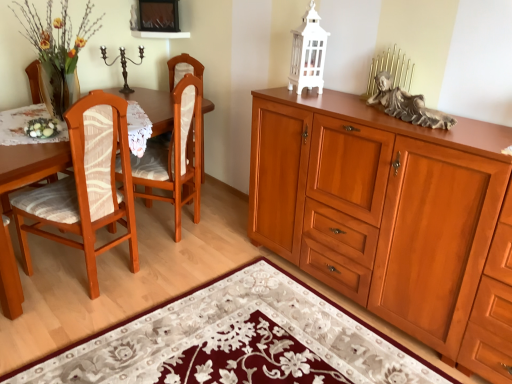
Describe the element at coordinates (407, 105) in the screenshot. I see `gray stone statue at upper right` at that location.

Measure the distance between point (41, 381) and camera.

Point (41, 381) is 5.51 feet away from camera.

Describe the element at coordinates (175, 155) in the screenshot. I see `wooden chair at left, which is the 2th chair from front to back` at that location.

This screenshot has width=512, height=384. I want to click on white lace tablecloth at left, so click(26, 124).

At what (x,y) coordinates should I click in order to perform the action: click on gray stone statue at upper right. Please return your answer as a coordinate pair (x, y). This screenshot has height=384, width=512. Looking at the image, I should click on (407, 105).

Measure the distance between wooden chair at left, arranged as the 1th chair when viewed from the back, and wooden chair at left, placed as the first chair when sorted from front to back.

wooden chair at left, arranged as the 1th chair when viewed from the back, is 40.01 centimeters away from wooden chair at left, placed as the first chair when sorted from front to back.

Locate an element on the screen. chair lying on the right of wooden chair at left, which ranks as the second chair in back-to-front order is located at coordinates (175, 155).

You are a GUI agent. You are given a task and a screenshot of the screen. Output one action in this format:
    pyautogui.click(x=<x>, y=<y>)
    Task: Click on the 1st chair below when counting from the gray stone statue at upper right (from the image's perspective)
    Image resolution: width=512 pixels, height=384 pixels.
    Given the screenshot: What is the action you would take?
    pyautogui.click(x=175, y=155)

Is wooden chair at left, arranged as the 1th chair when viewed from the back, in contact with gray stone statue at upper right?

No, wooden chair at left, arranged as the 1th chair when viewed from the back, is not making contact with gray stone statue at upper right.

Can we say wooden chair at left, which is the 2th chair from front to back, lies outside gray stone statue at upper right?

wooden chair at left, which is the 2th chair from front to back, lies outside gray stone statue at upper right's area.

Is the position of wooden chair at left, which is the 2th chair from front to back, less distant than that of gray stone statue at upper right?

No, wooden chair at left, which is the 2th chair from front to back, is behind gray stone statue at upper right.

How different are the orientations of white lace tablecloth at left and wooden chair at left, arranged as the 1th chair when viewed from the back, in degrees?

129 degrees separate the facing orientations of white lace tablecloth at left and wooden chair at left, arranged as the 1th chair when viewed from the back.

Considering the sizes of objects white lace tablecloth at left and wooden chair at left, which is the 2th chair from front to back, in the image provided, who is taller, white lace tablecloth at left or wooden chair at left, which is the 2th chair from front to back,?

With more height is wooden chair at left, which is the 2th chair from front to back.

Between point (134, 123) and point (177, 162), which one is positioned behind?

The point (177, 162) is farther.

Looking at their sizes, would you say white lace tablecloth at left is wider or thinner than wooden chair at left, arranged as the 1th chair when viewed from the back?

Clearly, white lace tablecloth at left has more width compared to wooden chair at left, arranged as the 1th chair when viewed from the back.

Looking at this image, between wooden cabinet at right and floral rug at lower center, which one has larger size?

With larger size is wooden cabinet at right.

Which object is thinner, wooden cabinet at right or floral rug at lower center?

With smaller width is wooden cabinet at right.

Which of these two, wooden cabinet at right or floral rug at lower center, stands taller?

Standing taller between the two is wooden cabinet at right.

Is wooden cabinet at right turned away from floral rug at lower center?

wooden cabinet at right is not turned away from floral rug at lower center.

In the scene shown: From a real-world perspective, which is physically above, floral rug at lower center or wooden chair at left, which ranks as the second chair in back-to-front order?

wooden chair at left, which ranks as the second chair in back-to-front order, from a real-world perspective.

Starting from the floral rug at lower center, which chair is the 2nd one to the left? Please provide its 2D coordinates.

[(86, 186)]

Is floral rug at lower center positioned with its back to wooden chair at left, placed as the first chair when sorted from front to back?

floral rug at lower center is not turned away from wooden chair at left, placed as the first chair when sorted from front to back.

From the image's perspective, which one is positioned lower, floral rug at lower center or wooden chair at left, placed as the first chair when sorted from front to back?

From the image's view, floral rug at lower center is below.

Which point is more forward, (192,167) or (272,312)?

Point (272,312)

Is wooden chair at left, arranged as the 1th chair when viewed from the back, to the left or to the right of floral rug at lower center in the image?

wooden chair at left, arranged as the 1th chair when viewed from the back, is to the left of floral rug at lower center.

From their relative heights in the image, would you say wooden chair at left, which is the 2th chair from front to back, is taller or shorter than floral rug at lower center?

Considering their sizes, wooden chair at left, which is the 2th chair from front to back, has more height than floral rug at lower center.

From the picture: From a real-world perspective, does white lace tablecloth at left sit lower than wooden cabinet at right?

No.

There is a wooden cabinet at right. In order to click on tablecloth above it (from a real-world perspective) in this screenshot , I will do `click(26, 124)`.

Is there a large distance between white lace tablecloth at left and wooden cabinet at right?

Absolutely, white lace tablecloth at left is distant from wooden cabinet at right.

Is white lace tablecloth at left in front of wooden cabinet at right?

No.

Identify the location of chair on the left side of wooden chair at left, which is the 2th chair from front to back. (86, 186).

This screenshot has height=384, width=512. I want to click on the 1st chair below when counting from the gray stone statue at upper right (from the image's perspective), so click(175, 155).

When comparing their distances from wooden cabinet at right, does wooden chair at left, which ranks as the second chair in back-to-front order, or gray stone statue at upper right seem closer?

gray stone statue at upper right.

Considering their positions, is floral rug at lower center positioned further to white lace tablecloth at left than wooden chair at left, which ranks as the second chair in back-to-front order?

Based on the image, floral rug at lower center appears to be further to white lace tablecloth at left.

Based on their spatial positions, is gray stone statue at upper right or white lace tablecloth at left closer to wooden cabinet at right?

gray stone statue at upper right is closer to wooden cabinet at right.

Estimate the real-world distances between objects in this image. Which object is closer to wooden cabinet at right, white lace tablecloth at left or wooden chair at left, arranged as the 1th chair when viewed from the back?

Based on the image, wooden chair at left, arranged as the 1th chair when viewed from the back, appears to be nearer to wooden cabinet at right.

Which object lies further to the anchor point wooden chair at left, which ranks as the second chair in back-to-front order, wooden chair at left, arranged as the 1th chair when viewed from the back, or gray stone statue at upper right?

gray stone statue at upper right is further to wooden chair at left, which ranks as the second chair in back-to-front order.

When comparing their distances from wooden chair at left, arranged as the 1th chair when viewed from the back, does wooden chair at left, which ranks as the second chair in back-to-front order, or gray stone statue at upper right seem further?

gray stone statue at upper right is positioned further to the anchor wooden chair at left, arranged as the 1th chair when viewed from the back.

Estimate the real-world distances between objects in this image. Which object is further from floral rug at lower center, white lace tablecloth at left or wooden chair at left, which ranks as the second chair in back-to-front order?

white lace tablecloth at left.

Considering their positions, is wooden chair at left, which ranks as the second chair in back-to-front order, positioned further to floral rug at lower center than white lace tablecloth at left?

white lace tablecloth at left.

Locate an element on the screen. The height and width of the screenshot is (384, 512). cabinetry between wooden chair at left, placed as the first chair when sorted from front to back, and gray stone statue at upper right from left to right is located at coordinates (383, 212).

Identify the location of tablecloth between wooden chair at left, placed as the first chair when sorted from front to back, and wooden chair at left, which is the 2th chair from front to back, along the z-axis. (26, 124).

Locate an element on the screen. Image resolution: width=512 pixels, height=384 pixels. tablecloth positioned between floral rug at lower center and wooden chair at left, arranged as the 1th chair when viewed from the back, from near to far is located at coordinates (26, 124).

Find the location of a particular element. The width and height of the screenshot is (512, 384). doormat situated between wooden chair at left, which ranks as the second chair in back-to-front order, and gray stone statue at upper right from left to right is located at coordinates (237, 341).